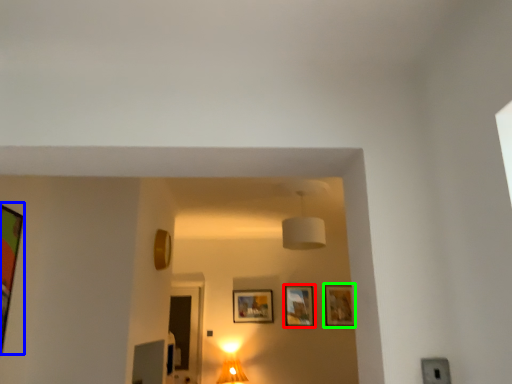
Question: Estimate the real-world distances between objects in this image. Which object is farther from picture frame (highlighted by a red box), picture frame (highlighted by a blue box) or picture frame (highlighted by a green box)?

Choices:
 (A) picture frame
 (B) picture frame

Answer: (A)